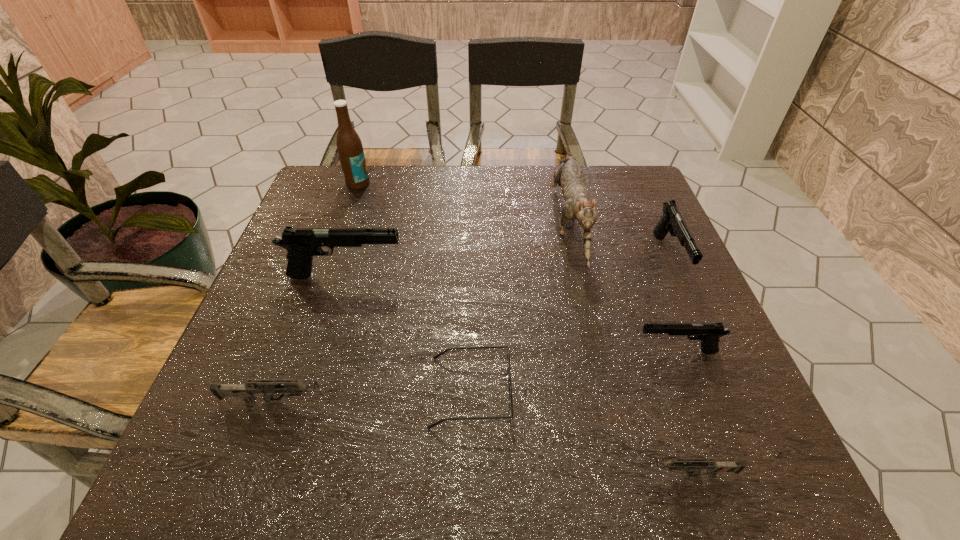
Where is `object that is at the near right corner`? Image resolution: width=960 pixels, height=540 pixels. object that is at the near right corner is located at coordinates (695, 465).

The width and height of the screenshot is (960, 540). In order to click on vacant space at the far edge in this screenshot , I will do `click(436, 183)`.

In the image, there is a desktop. Where is `vacant space at the near edge`? Image resolution: width=960 pixels, height=540 pixels. vacant space at the near edge is located at coordinates (539, 450).

Locate an element on the screen. This screenshot has width=960, height=540. free location at the left edge of the desktop is located at coordinates (295, 330).

This screenshot has width=960, height=540. Find the location of `vacant region at the right edge of the desktop`. vacant region at the right edge of the desktop is located at coordinates (686, 311).

Image resolution: width=960 pixels, height=540 pixels. In the image, there is a desktop. What are the coordinates of `vacant space at the far right corner` in the screenshot? It's located at (601, 166).

In the image, there is a desktop. Where is `vacant area at the near right corner`? Image resolution: width=960 pixels, height=540 pixels. vacant area at the near right corner is located at coordinates (731, 449).

Image resolution: width=960 pixels, height=540 pixels. I want to click on free space between the fifth shortest object and the leftmost black gun, so click(507, 267).

Where is `vacant region between the tallest object and the fifth object from right to left`? Image resolution: width=960 pixels, height=540 pixels. vacant region between the tallest object and the fifth object from right to left is located at coordinates (415, 287).

What are the coordinates of `free space between the seventh shortest object and the biggest black gun` in the screenshot? It's located at (456, 249).